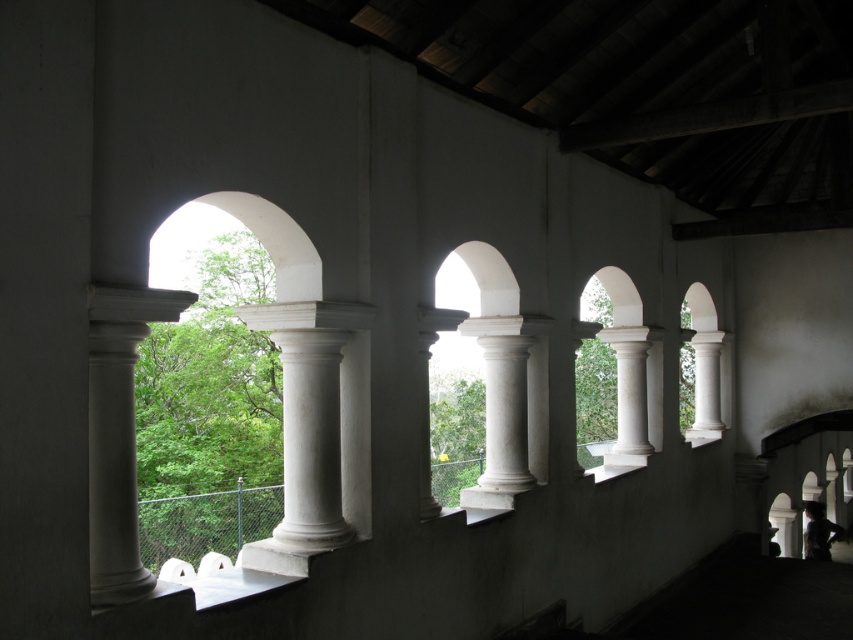
You are standing inside a building and want to reach the entrance located 20 feet away from you. There is a white marble column at left in front of you. Can you walk straight ahead without passing near the column?

The white marble column at left is only 12.49 feet away from you, so you can walk straight ahead without passing near it since it is closer than the entrance which is 20 feet away.

You are an architect designing a replica of this building. You need to ensure that the columns match the original dimensions. Which column, the white marble column at left or the white marble column at center, should you use as a reference for a narrower column?

The white marble column at left is narrower than the white marble column at center, so you should use the white marble column at left as the reference for a narrower column.